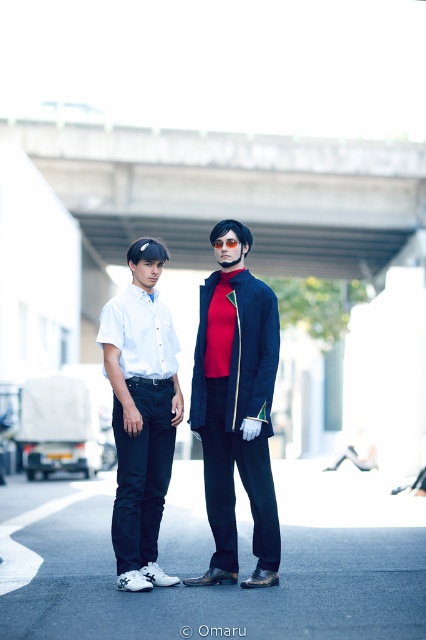
Find the location of `matte black jacket at center`. matte black jacket at center is located at coordinates point(236,406).

Between point (250, 241) and point (143, 509), which one is positioned behind?

Positioned behind is point (250, 241).

Is point (201, 353) closer to camera compared to point (123, 536)?

No, it is behind (123, 536).

The width and height of the screenshot is (426, 640). Identify the location of matte black jacket at center. (236, 406).